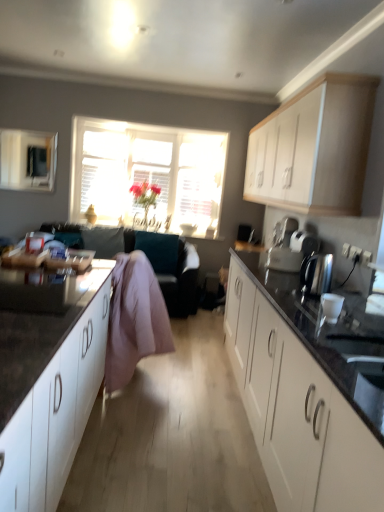
Question: Choose the correct answer: Is matte black microwave at upper left inside white matte cabinet at upper right, acting as the third cabinetry starting from the left, or outside it?

Choices:
 (A) outside
 (B) inside

Answer: (A)

Question: In the image, is matte black microwave at upper left on the left side or the right side of white matte cabinet at upper right, positioned as the 1th cabinetry in right-to-left order?

Choices:
 (A) left
 (B) right

Answer: (A)

Question: Which of these objects is positioned closest to the white matte cabinet at upper right, acting as the third cabinetry starting from the left?

Choices:
 (A) matte black microwave at upper left
 (B) pink fabric at center
 (C) white matte cabinet at right, the second cabinetry in the left-to-right sequence
 (D) white matte cabinet at lower left, which ranks as the 1th cabinetry in left-to-right order
 (E) satin silver toaster at upper right

Answer: (E)

Question: Which object is positioned closest to the satin silver toaster at upper right?

Choices:
 (A) translucent glass window at center
 (B) white matte cabinet at upper right, acting as the third cabinetry starting from the left
 (C) white matte cabinet at right, the second cabinetry in the left-to-right sequence
 (D) matte black microwave at upper left
 (E) pink fabric at center

Answer: (B)